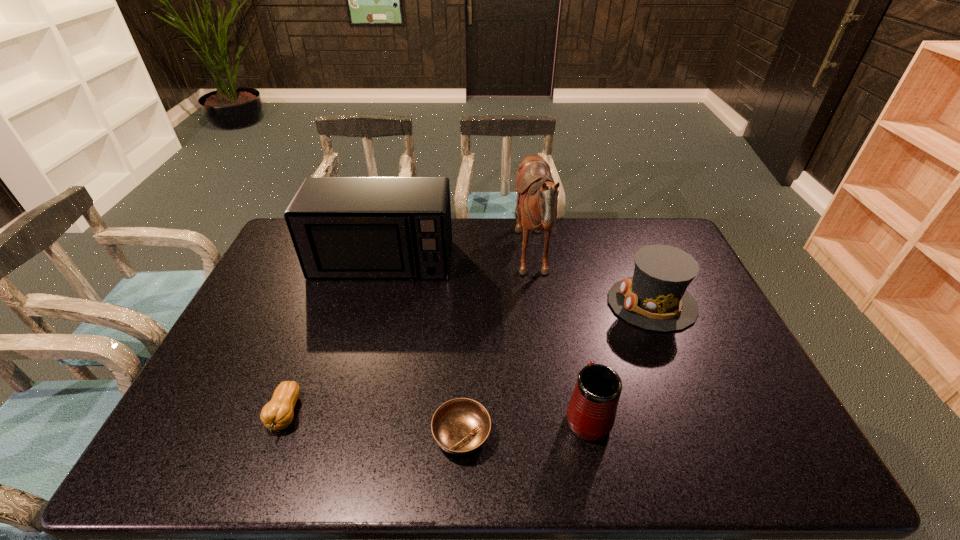
The image size is (960, 540). What are the coordinates of `free space located with goggles on the front of the rightmost object` in the screenshot? It's located at (513, 303).

Where is `vacant space located with goggles on the front of the rightmost object`? Image resolution: width=960 pixels, height=540 pixels. vacant space located with goggles on the front of the rightmost object is located at coordinates (484, 303).

The height and width of the screenshot is (540, 960). I want to click on vacant space positioned 0.130m with goggles on the front of the rightmost object, so click(x=566, y=303).

Locate an element on the screen. vacant space located on the side of the mug with the handle is located at coordinates (574, 353).

Locate an element on the screen. This screenshot has height=540, width=960. vacant space situated 0.100m on the side of the mug with the handle is located at coordinates (576, 359).

Where is `vacant space located on the side of the mug with the handle`? Image resolution: width=960 pixels, height=540 pixels. vacant space located on the side of the mug with the handle is located at coordinates [x=561, y=286].

At what (x,y) coordinates should I click in order to perform the action: click on free spot located on the right of the soup bowl. Please return your answer as a coordinate pair (x, y). Looking at the image, I should click on (516, 435).

Locate an element on the screen. Image resolution: width=960 pixels, height=540 pixels. saddle positioned at the far edge is located at coordinates (537, 195).

The width and height of the screenshot is (960, 540). I want to click on microwave_oven that is at the far edge, so click(341, 227).

You are a GUI agent. You are given a task and a screenshot of the screen. Output one action in this format:
    pyautogui.click(x=<x>, y=<y>)
    Task: Click on the mug that is at the near edge
    The width and height of the screenshot is (960, 540).
    Given the screenshot: What is the action you would take?
    pyautogui.click(x=591, y=412)